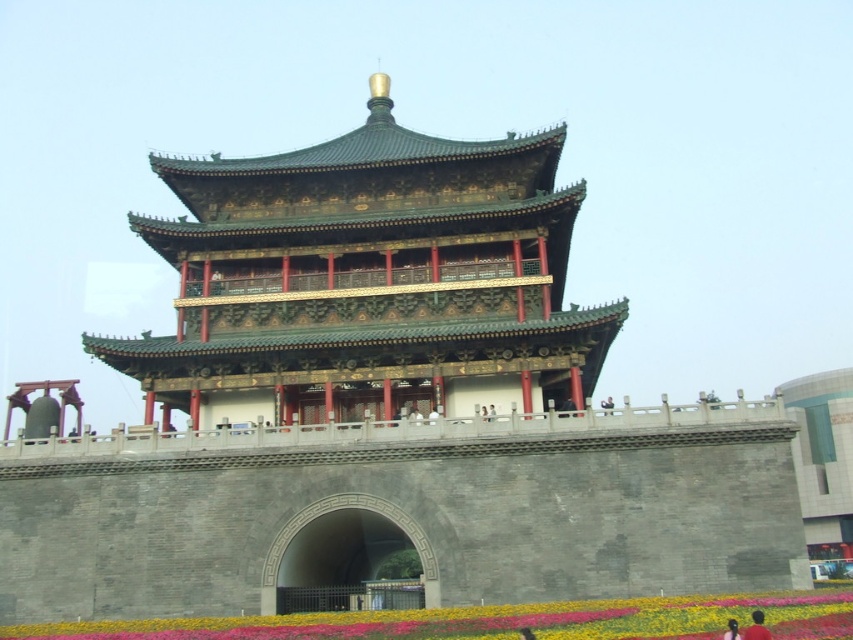
Does green glazed tile tower at center lie behind vibrant floral carpet at lower center?

Yes, green glazed tile tower at center is further from the viewer.

Who is higher up, green glazed tile tower at center or vibrant floral carpet at lower center?

green glazed tile tower at center is above.

Who is more distant from viewer, (445, 182) or (548, 608)?

The point (445, 182) is more distant.

Where is `green glazed tile tower at center`? The width and height of the screenshot is (853, 640). green glazed tile tower at center is located at coordinates (367, 280).

Does point (195, 385) come closer to viewer compared to point (763, 636)?

No, (195, 385) is behind (763, 636).

Which is in front, point (459, 288) or point (747, 636)?

Point (747, 636)

This screenshot has width=853, height=640. In order to click on green glazed tile tower at center in this screenshot , I will do click(367, 280).

Is vibrant floral carpet at lower center wider than dark brown hair at lower right?

Indeed, vibrant floral carpet at lower center has a greater width compared to dark brown hair at lower right.

Locate an element on the screen. Image resolution: width=853 pixels, height=640 pixels. vibrant floral carpet at lower center is located at coordinates (468, 620).